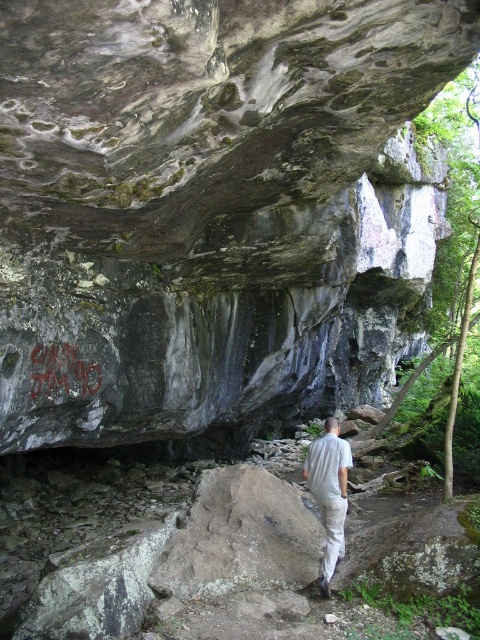
You are a hiker approaching the dark gray textured rock at center and the graffiti stone at center. Which one would you encounter first as you move forward?

You would encounter the dark gray textured rock at center first because it is closer to you than the graffiti stone at center.

You are standing at the entrance of the cave and notice the light gray cotton shirt at center and the graffiti stone at center. Which object is positioned to the right side from your perspective?

The light gray cotton shirt at center is to the right of the graffiti stone at center, so the light gray cotton shirt at center is positioned to the right side from your perspective.

You are a hiker standing at the entrance of the cave formed by the dark gray textured rock at center and the light gray cotton shirt at center. Which object is closer to you?

The dark gray textured rock at center is closer to you than the light gray cotton shirt at center.